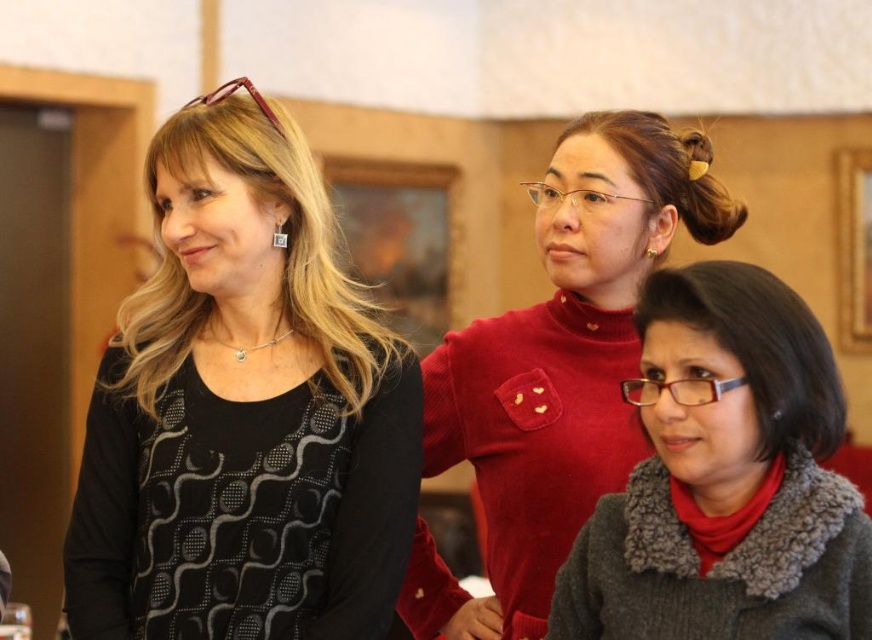
Question: Estimate the real-world distances between objects in this image. Which object is closer to the black dotted sweater at left?

Choices:
 (A) gray fuzzy sweater at center
 (B) matte red sweater at center
 (C) silver metallic square earring at upper left

Answer: (C)

Question: Estimate the real-world distances between objects in this image. Which object is closer to the matte red sweater at center?

Choices:
 (A) gray fuzzy sweater at center
 (B) silver metallic square earring at upper left

Answer: (A)

Question: Is black dotted sweater at left thinner than silver metallic square earring at upper left?

Choices:
 (A) yes
 (B) no

Answer: (B)

Question: Among these objects, which one is nearest to the camera?

Choices:
 (A) black dotted sweater at left
 (B) gray fuzzy sweater at center
 (C) matte red sweater at center

Answer: (B)

Question: Is black dotted sweater at left to the right of silver metallic square earring at upper left from the viewer's perspective?

Choices:
 (A) no
 (B) yes

Answer: (A)

Question: Is gray fuzzy sweater at center above matte red sweater at center?

Choices:
 (A) yes
 (B) no

Answer: (B)